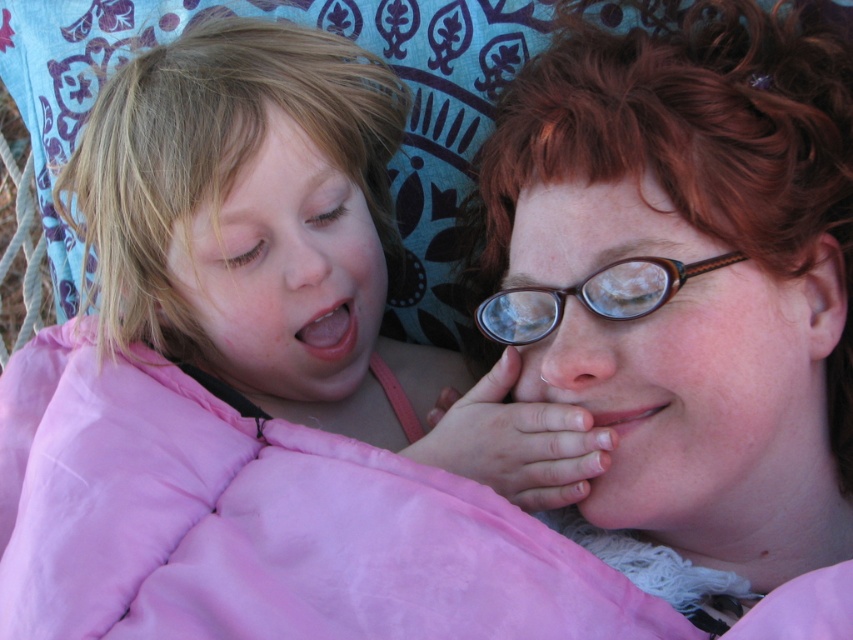
From the picture: Which is above, pink fabric at left or brown/leather glasses at center?

pink fabric at left is higher up.

Does point (296, 397) lie in front of point (589, 305)?

No, it is behind (589, 305).

Find the location of a particular element. The image size is (853, 640). pink fabric at left is located at coordinates (283, 273).

Does point (688, 417) come in front of point (648, 285)?

Yes, point (688, 417) is closer to viewer.

Which is in front, point (548, 380) or point (593, 282)?

Point (593, 282)

Locate an element on the screen. This screenshot has height=640, width=853. matte brown glasses at center is located at coordinates (699, 403).

Is matte pink jacket at center to the left of brown/leather glasses at center from the viewer's perspective?

No, matte pink jacket at center is not to the left of brown/leather glasses at center.

Is matte pink jacket at center taller than brown/leather glasses at center?

Yes.

Identify the location of matte pink jacket at center. The image size is (853, 640). (688, 278).